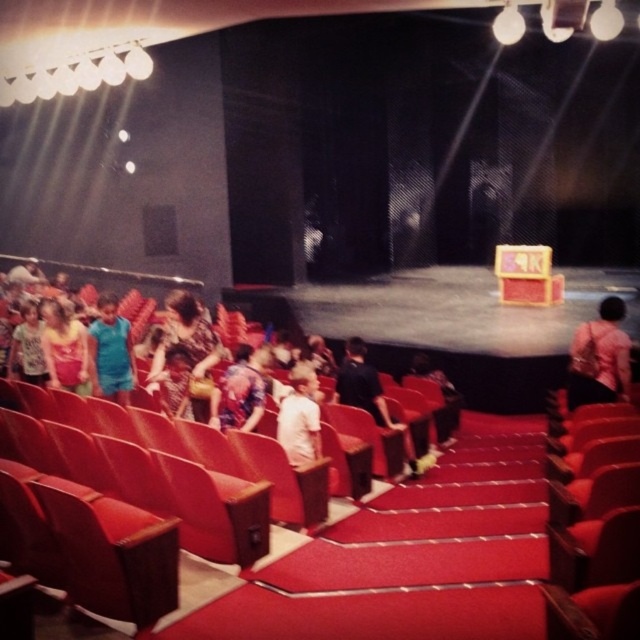
You are a stagehand trying to place a 5 meter long ladder between the pink fabric purse at center and the matte white shirt at center. Can you fit the ladder horizontally between them without bending it?

The distance between the pink fabric purse at center and the matte white shirt at center is 5.35 meters, so the 5 meter long ladder can fit horizontally between them since it is shorter than the available space.

You are standing in the theater and want to reach the point marked as point (596, 396). If your walking speed is 1.2 meters per second, how many seconds will it take you to reach that point?

The distance of point (596, 396) from viewer is 5.00 meters. At a walking speed of 1.2 meters per second, it will take approximately 4.17 seconds to reach the point.

You are standing at the back of the theater and see both the floral fabric dress at center and the matte white shirt at center. Which person is sitting closer to the front row?

The floral fabric dress at center is closer to the viewer than the matte white shirt at center, so the person wearing the floral fabric dress at center is sitting closer to the front row.